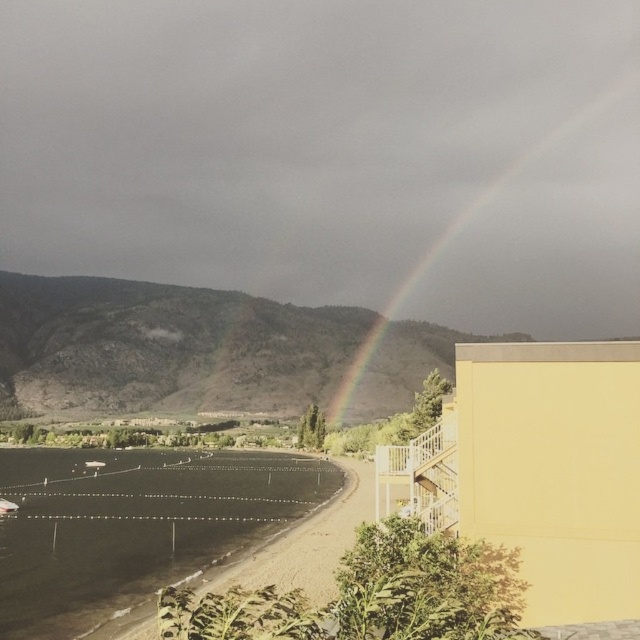
Question: Can you confirm if black asphalt runway at lower left is bigger than rainbow at upper right?

Choices:
 (A) yes
 (B) no

Answer: (B)

Question: Can you confirm if black asphalt runway at lower left is positioned above rainbow at upper right?

Choices:
 (A) yes
 (B) no

Answer: (B)

Question: Which object is farther from the camera taking this photo?

Choices:
 (A) rainbow at upper right
 (B) black asphalt runway at lower left

Answer: (A)

Question: Which point is farther to the camera?

Choices:
 (A) black asphalt runway at lower left
 (B) rainbow at upper right

Answer: (B)

Question: Can you confirm if black asphalt runway at lower left is wider than rainbow at upper right?

Choices:
 (A) no
 (B) yes

Answer: (A)